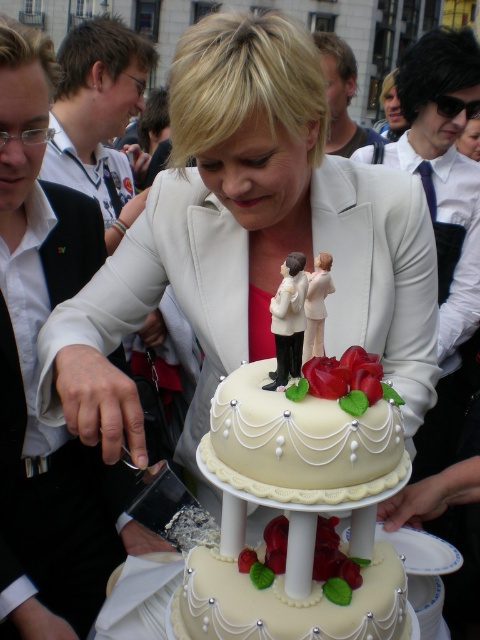
Question: Does white glossy cake at center lie in front of brushed metal shirt at left?

Choices:
 (A) yes
 (B) no

Answer: (A)

Question: Does white glossy cake at center appear on the right side of ivory fondant cake at center?

Choices:
 (A) no
 (B) yes

Answer: (A)

Question: Which point is closer to the camera?

Choices:
 (A) (180, 204)
 (B) (249, 588)

Answer: (B)

Question: Estimate the real-world distances between objects in this image. Which object is farther from the dark brown hair at upper center?

Choices:
 (A) white shirt at left
 (B) white glossy cake at center
 (C) ivory fondant cake at center

Answer: (C)

Question: Is white glossy cake at center positioned before white shirt at left?

Choices:
 (A) no
 (B) yes

Answer: (A)

Question: Which point is farther to the camera?

Choices:
 (A) (370, 180)
 (B) (351, 58)
 (C) (108, 211)

Answer: (B)